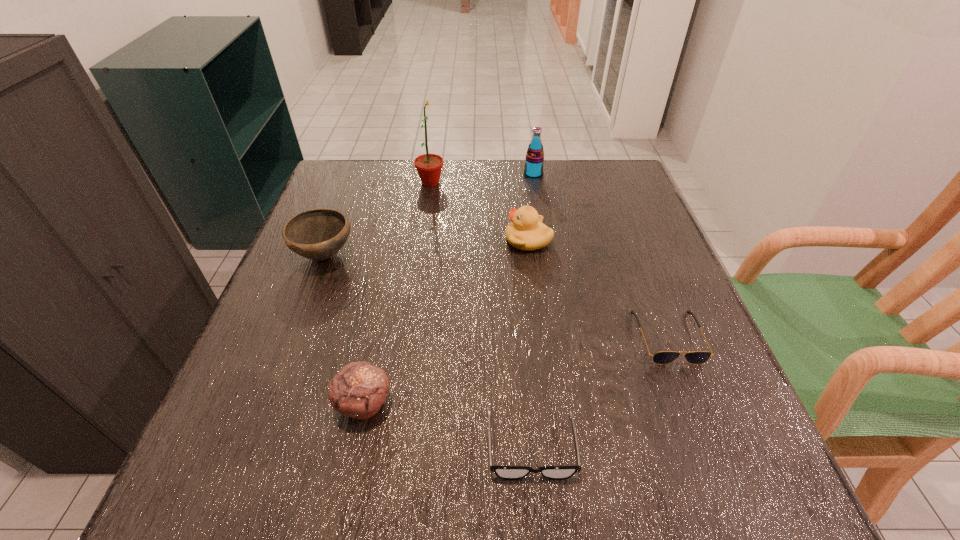
You are a GUI agent. You are given a task and a screenshot of the screen. Output one action in this format:
    pyautogui.click(x=<x>, y=<y>)
    Task: Click on the free spot located on the beak of the duckling
    
    Given the screenshot: What is the action you would take?
    pyautogui.click(x=483, y=240)

At what (x,y) coordinates should I click in order to perform the action: click on free space located 0.390m on the beak of the duckling. Please return your answer as a coordinate pair (x, y). The image size is (960, 540). Looking at the image, I should click on (337, 240).

The width and height of the screenshot is (960, 540). Find the location of `vacant region located on the beak of the duckling`. vacant region located on the beak of the duckling is located at coordinates click(410, 240).

The height and width of the screenshot is (540, 960). In order to click on free space located on the right of the bowl in this screenshot , I will do `click(396, 255)`.

Image resolution: width=960 pixels, height=540 pixels. Identify the location of vacant region located 0.060m on the right of the muffin. (429, 404).

In order to click on vacant area located 0.180m on the front-facing side of the third nearest object in this screenshot , I will do `click(718, 467)`.

Where is `sunflower present at the far edge`? The height and width of the screenshot is (540, 960). sunflower present at the far edge is located at coordinates (429, 166).

The width and height of the screenshot is (960, 540). Identify the location of soda that is positioned at the far edge. (533, 167).

The image size is (960, 540). I want to click on object that is at the near edge, so [x=504, y=472].

Locate an element on the screen. The image size is (960, 540). object that is at the left edge is located at coordinates (318, 234).